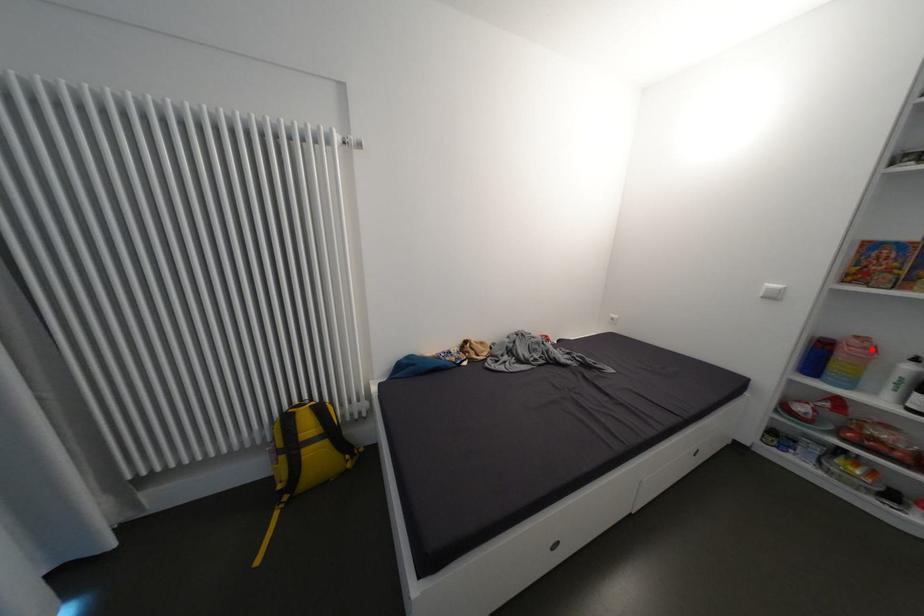
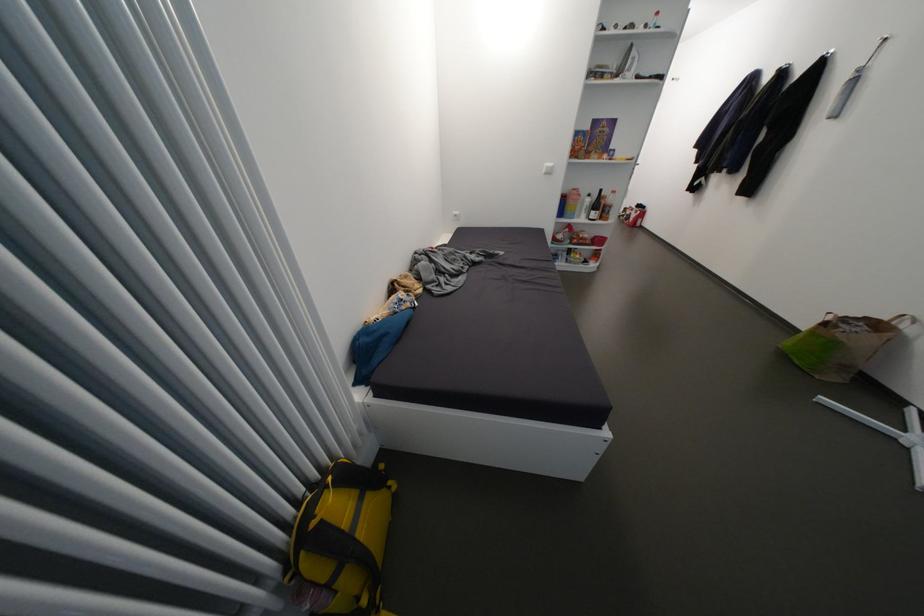
Question: I am providing you with two images of the same scene from different viewpoints. A red point is shown in image1. For the corresponding object point in image2, is it positioned nearer or farther from the camera?

Choices:
 (A) Nearer
 (B) Farther

Answer: (A)